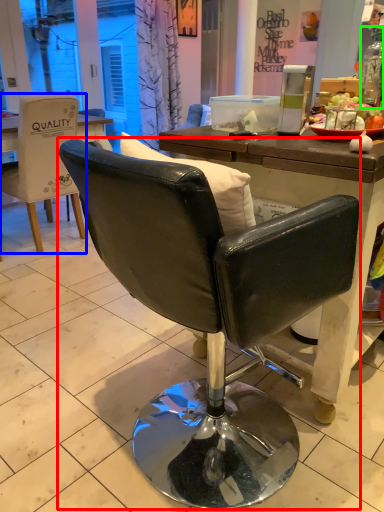
Question: Which object is positioned closest to chair (highlighted by a red box)? Select from chair (highlighted by a blue box) and bottle (highlighted by a green box).

Choices:
 (A) chair
 (B) bottle

Answer: (B)